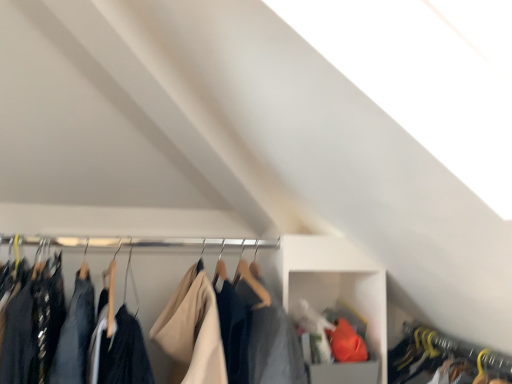
Question: Can you confirm if dark blue fabric at center, the second closet when ordered from right to left, is bigger than white plastic cabinet at center?

Choices:
 (A) yes
 (B) no

Answer: (A)

Question: Is dark blue fabric at center, the second closet when ordered from right to left, far away from white plastic cabinet at center?

Choices:
 (A) yes
 (B) no

Answer: (B)

Question: From a real-world perspective, does dark blue fabric at center, placed as the first closet when sorted from left to right, sit lower than white plastic cabinet at center?

Choices:
 (A) no
 (B) yes

Answer: (A)

Question: Can you confirm if dark blue fabric at center, placed as the first closet when sorted from left to right, is thinner than white plastic cabinet at center?

Choices:
 (A) yes
 (B) no

Answer: (B)

Question: Is white plastic cabinet at center inside dark blue fabric at center, the second closet when ordered from right to left?

Choices:
 (A) no
 (B) yes

Answer: (A)

Question: Is yellow hanger at lower right, which is the 2th closet from left to right, wider or thinner than white plastic cabinet at center?

Choices:
 (A) thin
 (B) wide

Answer: (B)

Question: Is yellow hanger at lower right, which is the first closet from right to left, to the left or to the right of white plastic cabinet at center in the image?

Choices:
 (A) right
 (B) left

Answer: (A)

Question: Is point (486, 349) positioned closer to the camera than point (294, 304)?

Choices:
 (A) closer
 (B) farther

Answer: (B)

Question: Is yellow hanger at lower right, which is the 2th closet from left to right, spatially inside white plastic cabinet at center, or outside of it?

Choices:
 (A) outside
 (B) inside

Answer: (A)

Question: Looking at their shapes, would you say dark blue fabric at center, placed as the first closet when sorted from left to right, is wider or thinner than yellow hanger at lower right, which is the first closet from right to left?

Choices:
 (A) thin
 (B) wide

Answer: (A)

Question: From the image's perspective, is dark blue fabric at center, placed as the first closet when sorted from left to right, located above or below yellow hanger at lower right, which is the first closet from right to left?

Choices:
 (A) above
 (B) below

Answer: (A)

Question: Based on their sizes in the image, would you say dark blue fabric at center, the second closet when ordered from right to left, is bigger or smaller than yellow hanger at lower right, which is the 2th closet from left to right?

Choices:
 (A) big
 (B) small

Answer: (A)

Question: Based on their positions, is dark blue fabric at center, the second closet when ordered from right to left, located to the left or right of yellow hanger at lower right, which is the 2th closet from left to right?

Choices:
 (A) right
 (B) left

Answer: (B)

Question: Looking at the image, does white plastic cabinet at center seem bigger or smaller compared to yellow hanger at lower right, which is the first closet from right to left?

Choices:
 (A) small
 (B) big

Answer: (B)

Question: Does point (283, 299) appear closer or farther from the camera than point (431, 337)?

Choices:
 (A) closer
 (B) farther

Answer: (A)